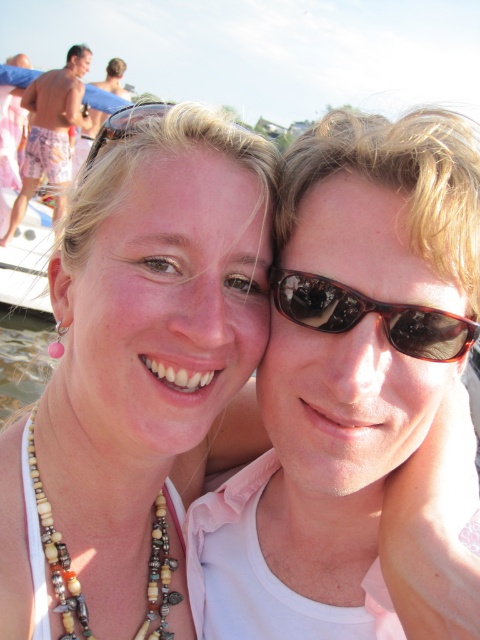
Is brown reflective sunglasses at center taller than shiny pink shorts at left?

In fact, brown reflective sunglasses at center may be shorter than shiny pink shorts at left.

Who is positioned more to the left, brown reflective sunglasses at center or shiny pink shorts at left?

shiny pink shorts at left is more to the left.

Which is in front, point (442, 356) or point (64, 108)?

Positioned in front is point (442, 356).

Locate an element on the screen. The image size is (480, 640). brown reflective sunglasses at center is located at coordinates (372, 310).

Which of these two, beige and brown beads necklace at lower left or matte black sunglasses at upper left, stands taller?

Standing taller between the two is beige and brown beads necklace at lower left.

Can you confirm if beige and brown beads necklace at lower left is positioned to the right of matte black sunglasses at upper left?

Incorrect, beige and brown beads necklace at lower left is not on the right side of matte black sunglasses at upper left.

Is point (177, 531) farther from viewer compared to point (135, 106)?

That is True.

Where is `beige and brown beads necklace at lower left`? beige and brown beads necklace at lower left is located at coordinates (57, 554).

Is point (29, 419) positioned behind point (72, 45)?

That is False.

Who is positioned more to the right, beige and brown beads necklace at lower left or shiny pink shorts at left?

From the viewer's perspective, beige and brown beads necklace at lower left appears more on the right side.

What do you see at coordinates (57, 554) in the screenshot?
I see `beige and brown beads necklace at lower left` at bounding box center [57, 554].

The width and height of the screenshot is (480, 640). Find the location of `beige and brown beads necklace at lower left`. beige and brown beads necklace at lower left is located at coordinates (57, 554).